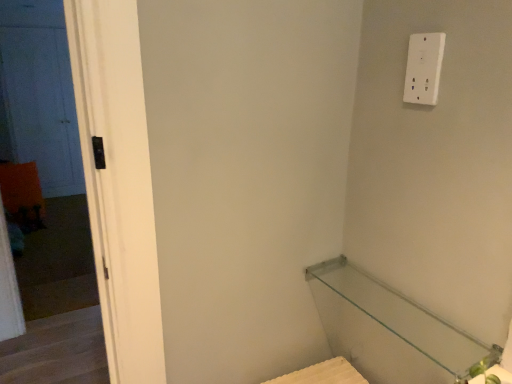
Where is `transparent glass shelf at lower right`? transparent glass shelf at lower right is located at coordinates (389, 329).

Describe the element at coordinates (389, 329) in the screenshot. The width and height of the screenshot is (512, 384). I see `transparent glass shelf at lower right` at that location.

This screenshot has height=384, width=512. Identify the location of white matte door at left. (40, 94).

You are a GUI agent. You are given a task and a screenshot of the screen. Output one action in this format:
    pyautogui.click(x=<x>, y=<y>)
    Task: Click on the white plastic light switch at upper right
    
    Given the screenshot: What is the action you would take?
    pyautogui.click(x=424, y=68)

At what (x,y) coordinates should I click in order to perform the action: click on black matte door at left. Please return your answer as a coordinate pair (x, y). Looking at the image, I should click on (41, 101).

Find the location of a particular element. This screenshot has height=384, width=512. transparent glass shelf at lower right is located at coordinates (389, 329).

Considering the relative sizes of transparent glass shelf at lower right and black matte door at left in the image provided, is transparent glass shelf at lower right taller than black matte door at left?

No.

Is transparent glass shelf at lower right smaller than black matte door at left?

Yes, transparent glass shelf at lower right is smaller than black matte door at left.

Are transparent glass shelf at lower right and black matte door at left beside each other?

No, transparent glass shelf at lower right is not touching black matte door at left.

Find the location of a particular element. screen door on the left of transparent glass shelf at lower right is located at coordinates (41, 101).

From the image's perspective, is white plastic light switch at upper right located beneath transparent glass shelf at lower right?

No, from the image's perspective, white plastic light switch at upper right is not below transparent glass shelf at lower right.

How far apart are white plastic light switch at upper right and transparent glass shelf at lower right?

The distance of white plastic light switch at upper right from transparent glass shelf at lower right is 23.55 inches.

Is white plastic light switch at upper right next to transparent glass shelf at lower right and touching it?

white plastic light switch at upper right and transparent glass shelf at lower right are not in contact.

Can you confirm if white plastic light switch at upper right is bigger than transparent glass shelf at lower right?

Actually, white plastic light switch at upper right might be smaller than transparent glass shelf at lower right.

Can you confirm if black matte door at left is shorter than white matte door at left?

Yes.

From the image's perspective, is black matte door at left located beneath white matte door at left?

Yes.

Considering the relative positions of black matte door at left and white matte door at left in the image provided, is black matte door at left to the left or to the right of white matte door at left?

In the image, black matte door at left appears on the right side of white matte door at left.

Could you tell me if black matte door at left is facing white matte door at left?

No.

Can you confirm if white matte door at left is positioned to the left of transparent glass shelf at lower right?

Correct, you'll find white matte door at left to the left of transparent glass shelf at lower right.

The width and height of the screenshot is (512, 384). Identify the location of balustrade below the white matte door at left (from the image's perspective). (389, 329).

Who is bigger, white matte door at left or transparent glass shelf at lower right?

white matte door at left.

Between white matte door at left and transparent glass shelf at lower right, which one has smaller width?

white matte door at left is thinner.

Looking at this image, are white plastic light switch at upper right and white matte door at left making contact?

No, white plastic light switch at upper right is not touching white matte door at left.

What are the coordinates of `door on the left of white plastic light switch at upper right` in the screenshot? It's located at (40, 94).

Measure the distance between white plastic light switch at upper right and white matte door at left.

The distance of white plastic light switch at upper right from white matte door at left is 5.76 meters.

Looking at their sizes, would you say white plastic light switch at upper right is wider or thinner than white matte door at left?

Clearly, white plastic light switch at upper right has less width compared to white matte door at left.

Which point is more forward, [17,30] or [408,68]?

Positioned in front is point [408,68].

From a real-world perspective, which object rests below the other?

black matte door at left, from a real-world perspective.

Is black matte door at left not within white plastic light switch at upper right?

Yes, black matte door at left is located beyond the bounds of white plastic light switch at upper right.

Who is bigger, black matte door at left or white plastic light switch at upper right?

black matte door at left is bigger.

From the picture: In the image, is white plastic light switch at upper right on the left side or the right side of black matte door at left?

Based on their positions, white plastic light switch at upper right is located to the right of black matte door at left.

Considering the relative sizes of white plastic light switch at upper right and black matte door at left in the image provided, is white plastic light switch at upper right bigger than black matte door at left?

Actually, white plastic light switch at upper right might be smaller than black matte door at left.

Is black matte door at left at the back of white plastic light switch at upper right?

white plastic light switch at upper right is not turned away from black matte door at left.

Is white plastic light switch at upper right completely or partially outside of black matte door at left?

Absolutely, white plastic light switch at upper right is external to black matte door at left.

Locate an element on the screen. screen door on the left of transparent glass shelf at lower right is located at coordinates click(x=41, y=101).

At what (x,y) coordinates should I click in order to perform the action: click on light switch on the right of transparent glass shelf at lower right. Please return your answer as a coordinate pair (x, y). The height and width of the screenshot is (384, 512). Looking at the image, I should click on (424, 68).

In the scene shown: When comparing their distances from transparent glass shelf at lower right, does white matte door at left or white plastic light switch at upper right seem further?

white matte door at left is further to transparent glass shelf at lower right.

Which object lies nearer to the anchor point transparent glass shelf at lower right, white matte door at left or black matte door at left?

Among the two, black matte door at left is located nearer to transparent glass shelf at lower right.

Which object lies nearer to the anchor point transparent glass shelf at lower right, white plastic light switch at upper right or white matte door at left?

white plastic light switch at upper right.

Looking at the image, which one is located closer to transparent glass shelf at lower right, black matte door at left or white plastic light switch at upper right?

Among the two, white plastic light switch at upper right is located nearer to transparent glass shelf at lower right.

From the image, which object appears to be farther from white plastic light switch at upper right, black matte door at left or white matte door at left?

The object further to white plastic light switch at upper right is white matte door at left.

Based on their spatial positions, is white plastic light switch at upper right or transparent glass shelf at lower right further from black matte door at left?

white plastic light switch at upper right lies further to black matte door at left than the other object.

Estimate the real-world distances between objects in this image. Which object is further from white matte door at left, white plastic light switch at upper right or black matte door at left?

Among the two, white plastic light switch at upper right is located further to white matte door at left.

When comparing their distances from white plastic light switch at upper right, does white matte door at left or transparent glass shelf at lower right seem closer?

transparent glass shelf at lower right lies closer to white plastic light switch at upper right than the other object.

Locate an element on the screen. screen door positioned between transparent glass shelf at lower right and white matte door at left from near to far is located at coordinates (41, 101).

Where is `screen door positioned between white plastic light switch at upper right and white matte door at left from near to far`? The image size is (512, 384). screen door positioned between white plastic light switch at upper right and white matte door at left from near to far is located at coordinates (41, 101).

Locate an element on the screen. Image resolution: width=512 pixels, height=384 pixels. light switch positioned between transparent glass shelf at lower right and white matte door at left from near to far is located at coordinates (424, 68).

Find the location of a particular element. balustrade between black matte door at left and white plastic light switch at upper right from left to right is located at coordinates (389, 329).